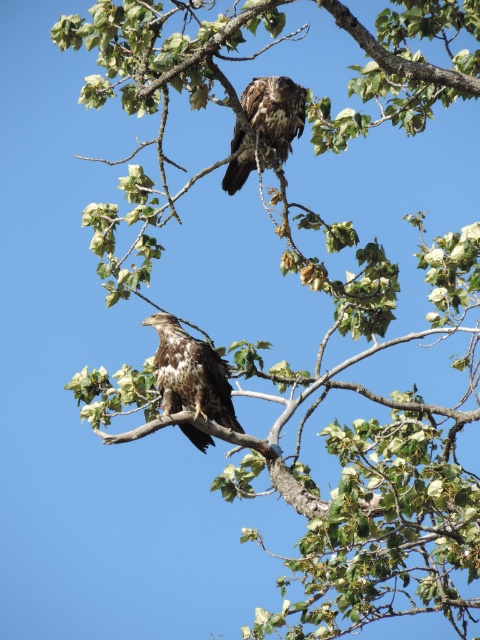
Question: Does brown speckled feathers at center have a lesser width compared to dark brown feathers at upper center?

Choices:
 (A) no
 (B) yes

Answer: (A)

Question: From the image, what is the correct spatial relationship of brown speckled feathers at center in relation to dark brown feathers at upper center?

Choices:
 (A) left
 (B) right

Answer: (A)

Question: Which object is closer to the camera taking this photo?

Choices:
 (A) brown speckled feathers at center
 (B) dark brown feathers at upper center

Answer: (A)

Question: Which point is closer to the camera?

Choices:
 (A) dark brown feathers at upper center
 (B) brown speckled feathers at center

Answer: (B)

Question: Observing the image, what is the correct spatial positioning of brown speckled feathers at center in reference to dark brown feathers at upper center?

Choices:
 (A) above
 (B) below

Answer: (B)